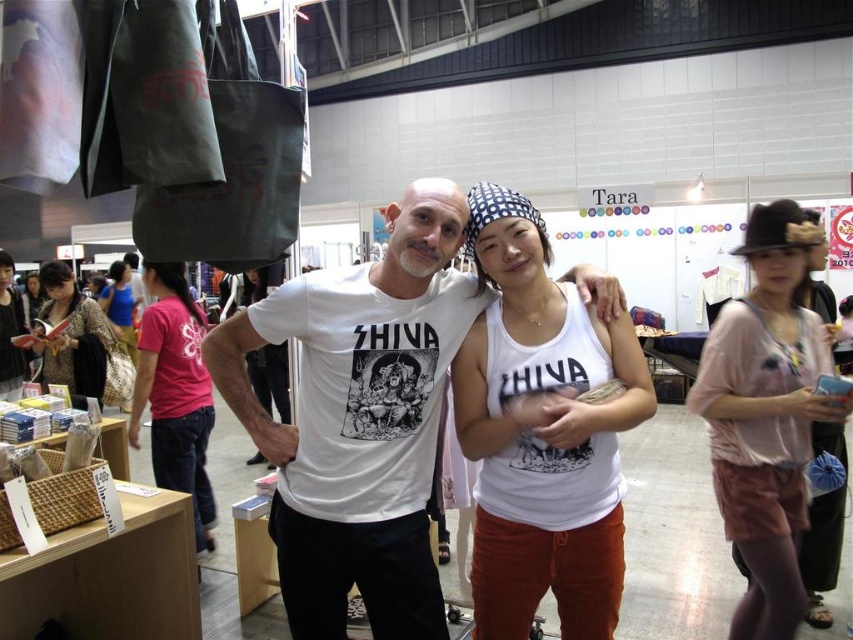
Who is lower down, white cotton tank top at center or matte black shirt at left?

white cotton tank top at center

Can you confirm if white cotton tank top at center is positioned to the left of matte black shirt at left?

Incorrect, white cotton tank top at center is not on the left side of matte black shirt at left.

Find the location of `white cotton tank top at center`. white cotton tank top at center is located at coordinates click(x=543, y=432).

Does pink fabric top at center have a lesser width compared to pink fabric shirt at left?

In fact, pink fabric top at center might be wider than pink fabric shirt at left.

Which is in front, point (734, 484) or point (177, 380)?

Positioned in front is point (734, 484).

Locate an element on the screen. The width and height of the screenshot is (853, 640). pink fabric top at center is located at coordinates (767, 416).

Does white cotton tank top at center appear on the right side of pink fabric shirt at left?

Indeed, white cotton tank top at center is positioned on the right side of pink fabric shirt at left.

Which is more to the right, white cotton tank top at center or pink fabric shirt at left?

white cotton tank top at center is more to the right.

Between point (486, 636) and point (170, 410), which one is positioned in front?

Point (486, 636) is more forward.

Identify the location of white cotton tank top at center. (543, 432).